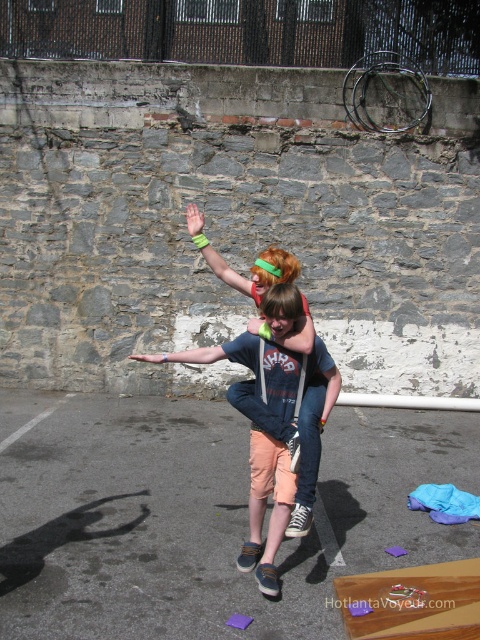
Question: Which of the following is the closest to the observer?

Choices:
 (A) smooth skin hand at center
 (B) denim shorts at center
 (C) matte blue jeans at center
 (D) green rubber wristband at upper center

Answer: (B)

Question: Does green rubber wristband at upper center have a smaller size compared to smooth skin hand at center?

Choices:
 (A) no
 (B) yes

Answer: (A)

Question: Can you confirm if green matte hand at upper center is positioned to the left of smooth skin hand at center?

Choices:
 (A) no
 (B) yes

Answer: (A)

Question: Can you confirm if green rubber wristband at upper center is wider than green matte hand at upper center?

Choices:
 (A) yes
 (B) no

Answer: (A)

Question: Estimate the real-world distances between objects in this image. Which object is closer to the matte blue jeans at center?

Choices:
 (A) smooth skin hand at center
 (B) green matte hand at upper center

Answer: (B)

Question: Which point is closer to the camera?

Choices:
 (A) (191, 234)
 (B) (135, 358)
 (C) (193, 353)

Answer: (C)